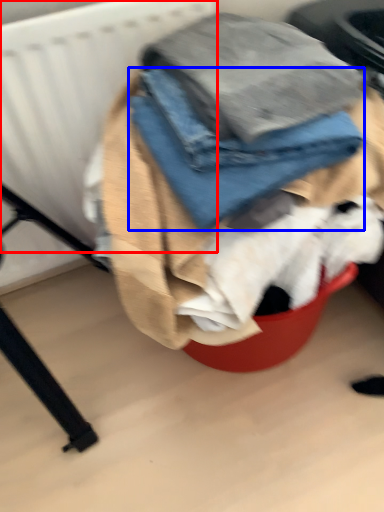
Question: Which of the following is the farthest to the observer, radiator (highlighted by a red box) or trousers (highlighted by a blue box)?

Choices:
 (A) radiator
 (B) trousers

Answer: (A)